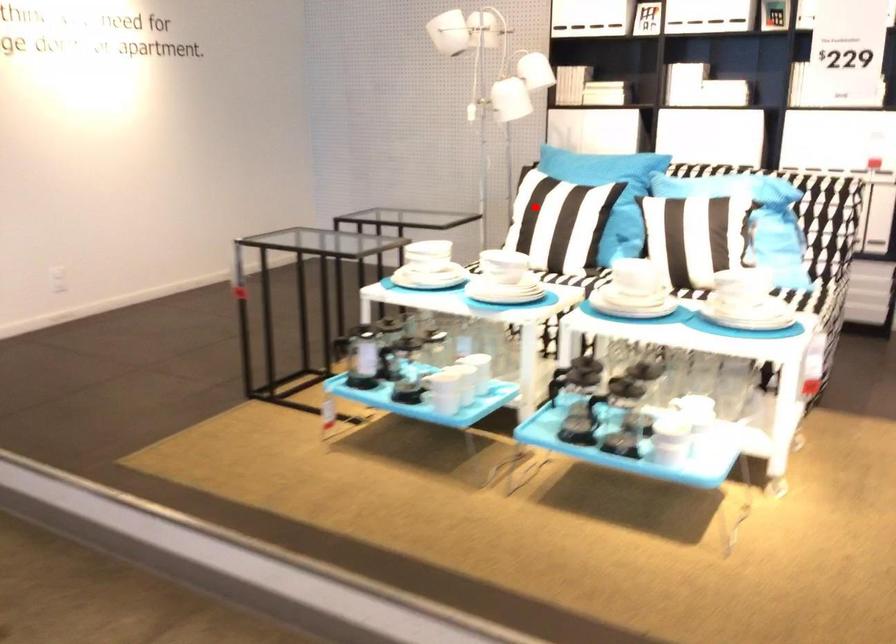
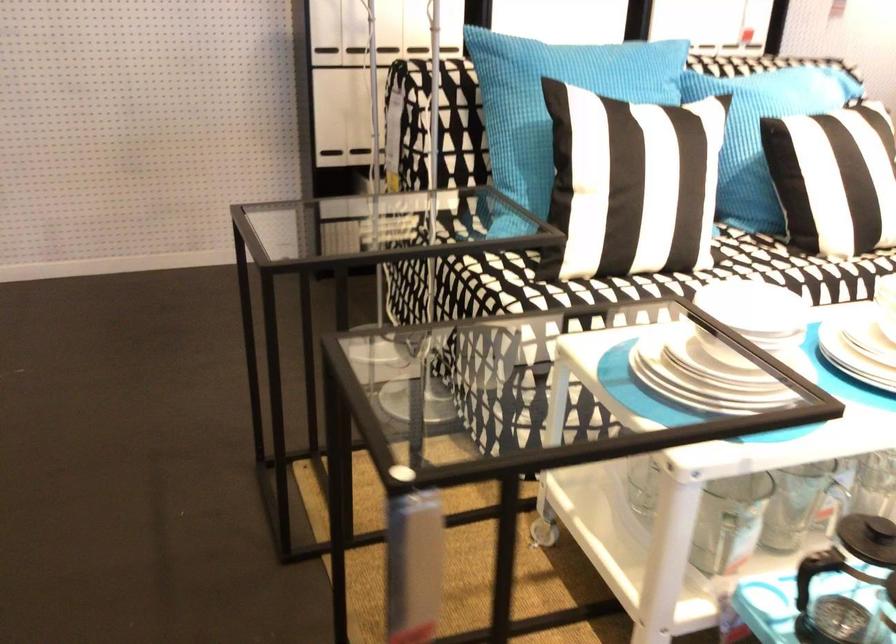
In the second image, find the point that corresponds to the highlighted location in the first image.

(617, 180)